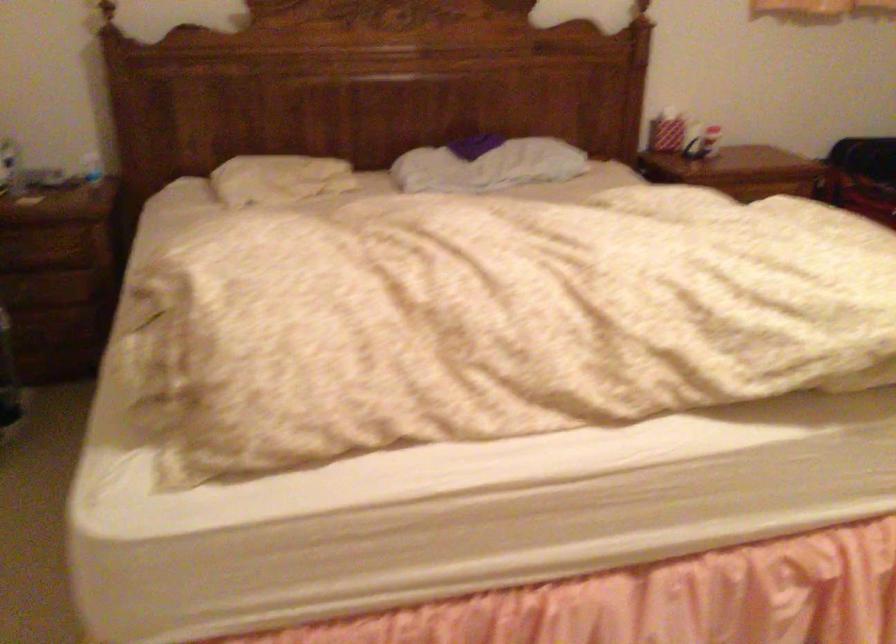
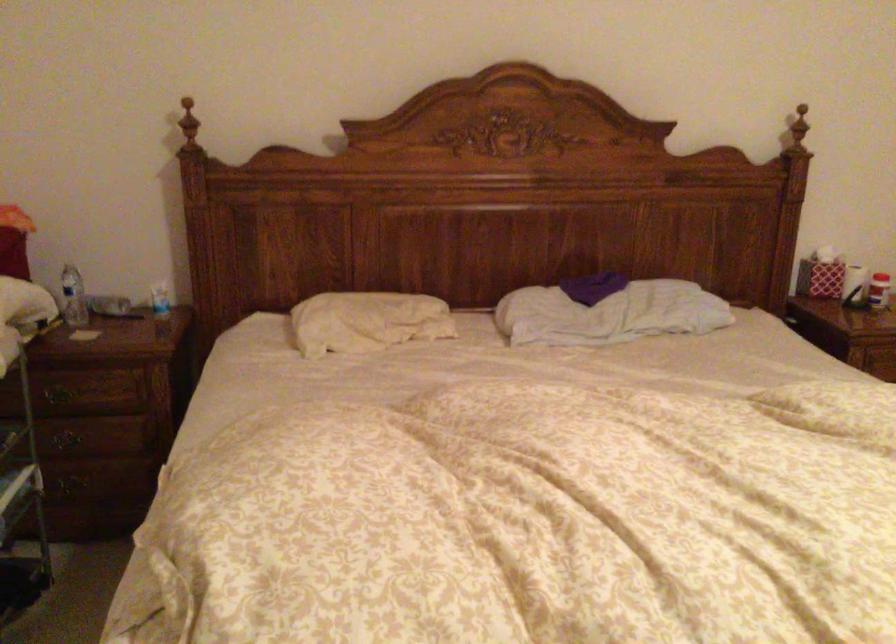
Question: What movement of the cameraman would produce the second image?

Choices:
 (A) Left
 (B) Right
 (C) Forward
 (D) Backward

Answer: (C)